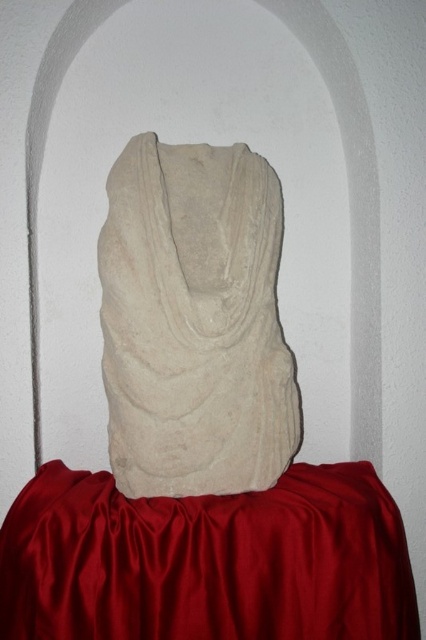
You are a curator arranging an exhibition and need to ensure the white stone bust at center is centered on the satin red tablecloth at center. Given the size difference, will the entire bust fit within the tablecloth without any part hanging off?

The satin red tablecloth at center has a larger size compared to the white stone bust at center, so the entire bust will fit within the tablecloth without any part hanging off.

From the picture: You are an art conservator examining the stone sculpture and the red tablecloth in the alcove. You need to determine if the tablecloth can fully cover the sculpture when placed over it. Based on their sizes, can the satin red tablecloth at center completely cover the white stone bust at center?

The satin red tablecloth at center is shorter than the white stone bust at center, so it cannot fully cover the sculpture.